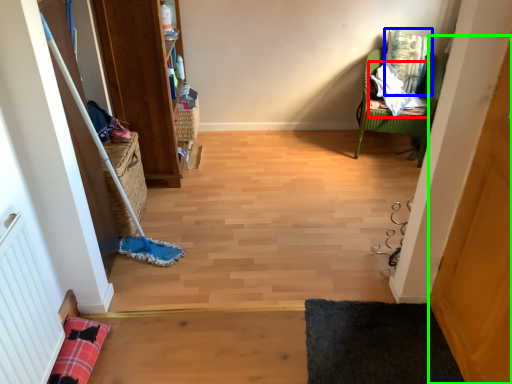
Question: Based on their relative distances, which object is nearer to material (highlighted by a red box)? Choose from pillow (highlighted by a blue box) and screen door (highlighted by a green box).

Choices:
 (A) pillow
 (B) screen door

Answer: (A)